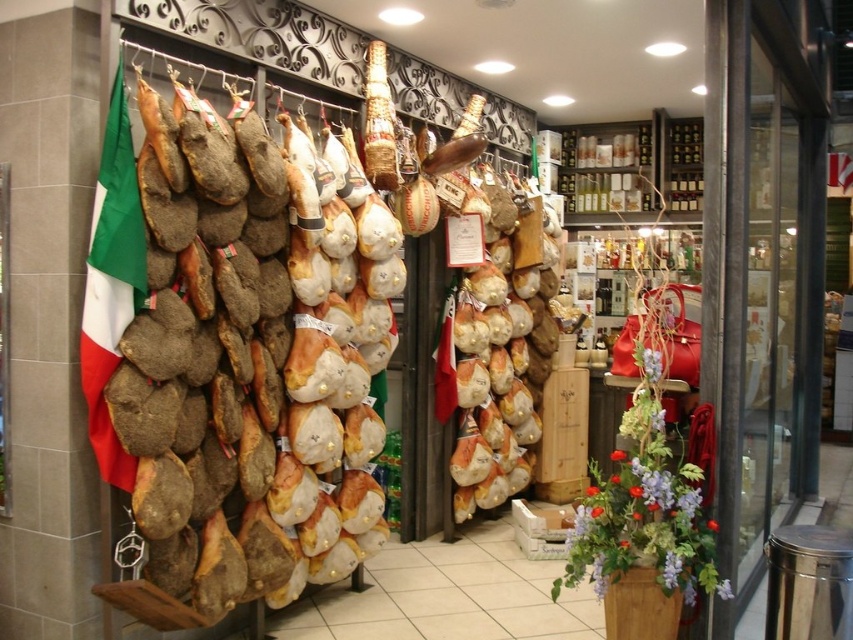
Question: Which point is farther to the camera?

Choices:
 (A) brown leather bag at center
 (B) brown textured cured meat at left

Answer: (A)

Question: Considering the relative positions of brown textured cured meat at left and brown leather bag at center in the image provided, where is brown textured cured meat at left located with respect to brown leather bag at center?

Choices:
 (A) below
 (B) above

Answer: (B)

Question: Does brown textured cured meat at left appear on the right side of brown leather bag at center?

Choices:
 (A) yes
 (B) no

Answer: (B)

Question: Can you confirm if brown textured cured meat at left is positioned below brown leather bag at center?

Choices:
 (A) yes
 (B) no

Answer: (B)